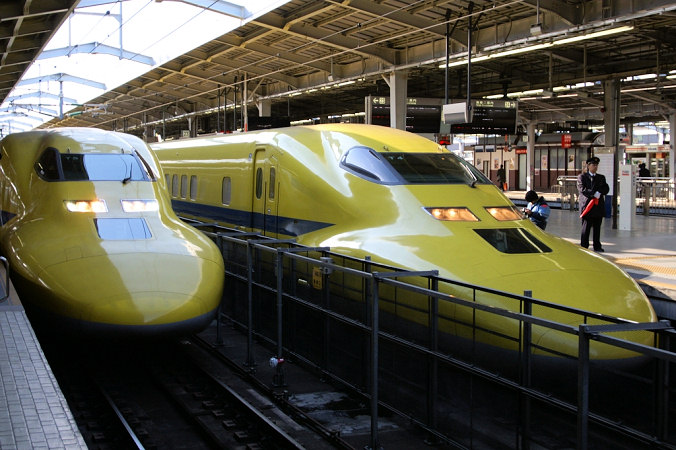
I want to click on doors, so click(x=264, y=179), click(x=272, y=185), click(x=524, y=172).